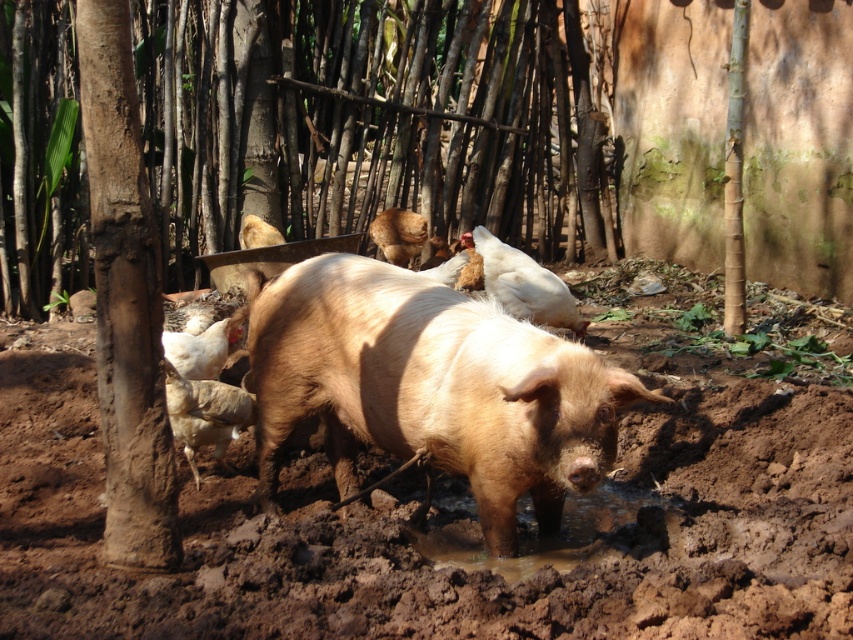
Who is higher up, brown wet mud at center or muddy wet puddle at lower center?

brown wet mud at center is above.

Which is in front, point (653, 579) or point (613, 504)?

Point (653, 579) is more forward.

Between point (173, 611) and point (633, 486), which one is positioned in front?

Point (173, 611) is more forward.

Identify the location of brown wet mud at center. (437, 540).

Does brown wet mud at center have a greater height compared to brown matte pig at upper center?

Yes.

Who is positioned more to the left, brown wet mud at center or brown matte pig at upper center?

Positioned to the left is brown wet mud at center.

Is point (288, 564) farther from viewer compared to point (424, 237)?

No, it is in front of (424, 237).

Identify the location of brown wet mud at center. This screenshot has height=640, width=853. (437, 540).

Looking at this image, can you confirm if muddy wet puddle at lower center is positioned above light brown fur at center?

Incorrect, muddy wet puddle at lower center is not positioned above light brown fur at center.

In the scene shown: Who is lower down, muddy wet puddle at lower center or light brown fur at center?

Positioned lower is muddy wet puddle at lower center.

Does point (521, 550) lie in front of point (256, 224)?

Yes.

Identify the location of muddy wet puddle at lower center. point(538,536).